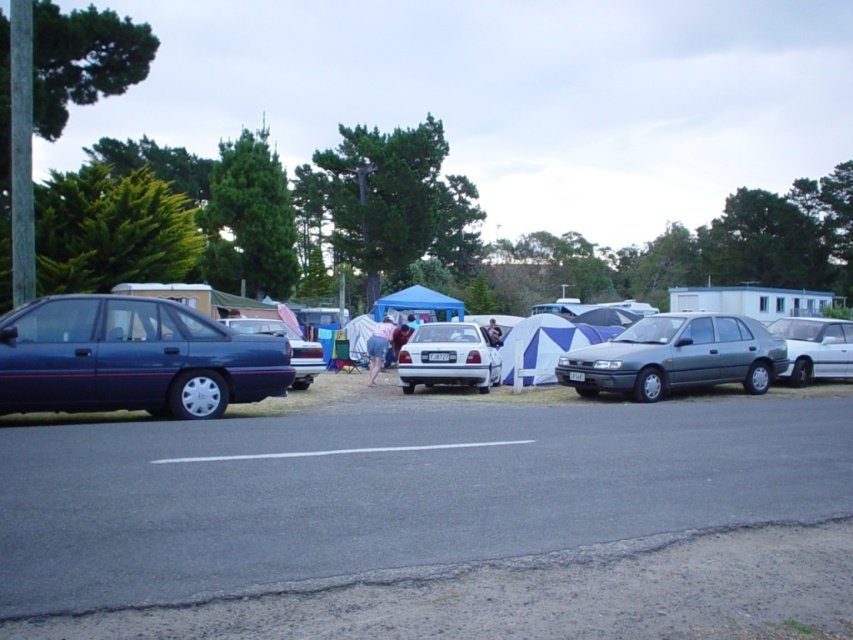
Based on the photo, does black asphalt parking lot at lower left have a lesser width compared to matte blue sedan at center?

In fact, black asphalt parking lot at lower left might be wider than matte blue sedan at center.

Who is more distant from viewer, (122, 572) or (233, 326)?

The point (233, 326) is behind.

Between point (276, 561) and point (293, 362), which one is positioned in front?

Point (276, 561)

Where is `black asphalt parking lot at lower left`? The height and width of the screenshot is (640, 853). black asphalt parking lot at lower left is located at coordinates coord(430,520).

Is black asphalt parking lot at lower left to the right of blue/white striped tent at center from the viewer's perspective?

Incorrect, black asphalt parking lot at lower left is not on the right side of blue/white striped tent at center.

Describe the element at coordinates (430, 520) in the screenshot. I see `black asphalt parking lot at lower left` at that location.

Identify the location of black asphalt parking lot at lower left. (430, 520).

Looking at this image, is the position of satin silver sedan at center more distant than that of white glossy sedan at right?

That is False.

Find the location of `satin silver sedan at center`. satin silver sedan at center is located at coordinates (676, 356).

You are a GUI agent. You are given a task and a screenshot of the screen. Output one action in this format:
    pyautogui.click(x=<x>, y=<y>)
    Task: Click on the satin silver sedan at center
    This screenshot has width=853, height=640.
    Given the screenshot: What is the action you would take?
    676,356